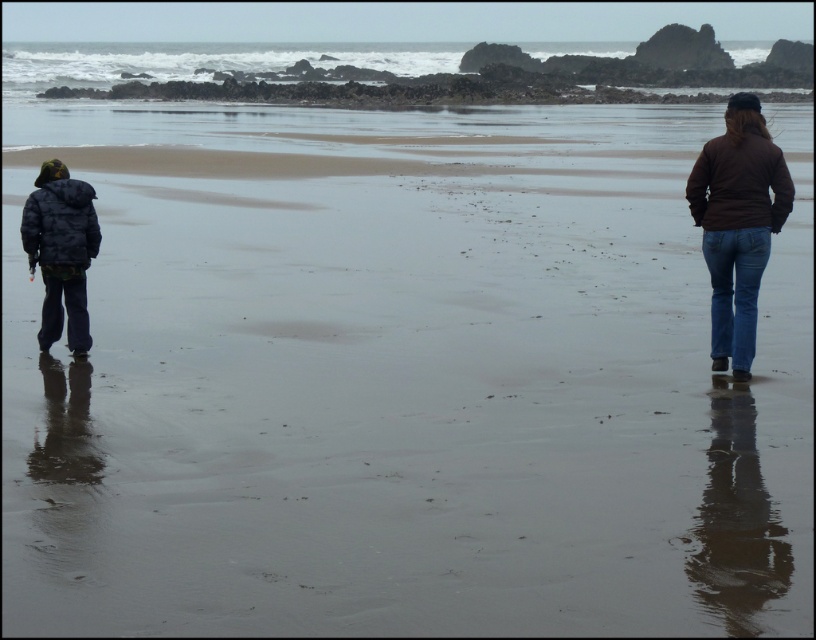
This screenshot has width=816, height=640. What do you see at coordinates (737, 225) in the screenshot?
I see `brown denim jeans at right` at bounding box center [737, 225].

Is brown denim jeans at right positioned at the back of dark gray puffy jacket at left?

No.

Is point (723, 198) positioned after point (32, 236)?

No, (723, 198) is closer to viewer.

Identify the location of brown denim jeans at right. The height and width of the screenshot is (640, 816). (737, 225).

Who is positioned more to the right, gray wet sand at upper center or brown denim jeans at right?

brown denim jeans at right is more to the right.

Which is behind, point (200, 65) or point (721, 250)?

The point (200, 65) is more distant.

Between point (306, 92) and point (726, 220), which one is positioned in front?

Point (726, 220) is in front.

The height and width of the screenshot is (640, 816). In order to click on gray wet sand at upper center in this screenshot , I will do pos(364,74).

Consider the image. Does gray wet sand at upper center have a greater height compared to blue denim jeans at right?

Yes, gray wet sand at upper center is taller than blue denim jeans at right.

Which is in front, point (522, 52) or point (717, 269)?

Point (717, 269) is in front.

Where is `gray wet sand at upper center`? gray wet sand at upper center is located at coordinates (364, 74).